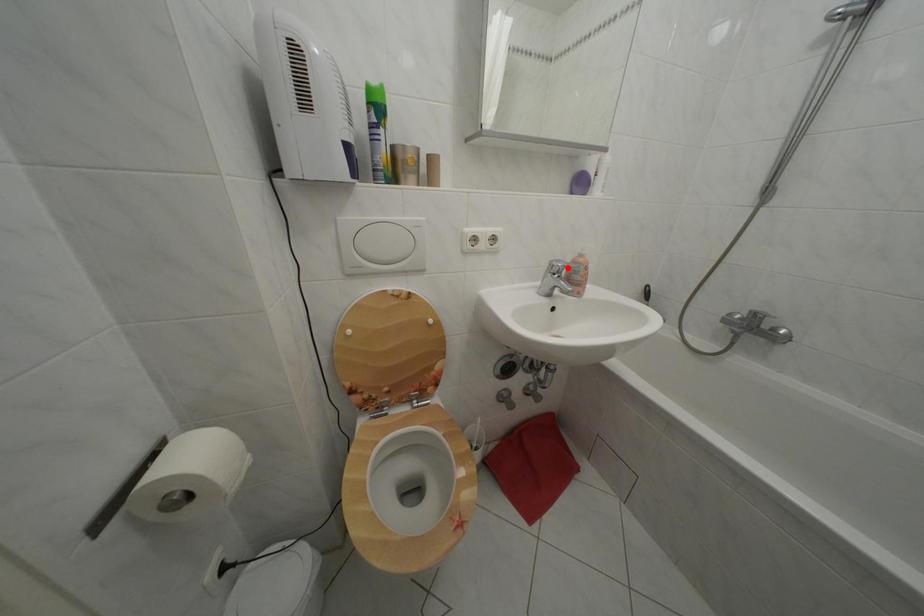
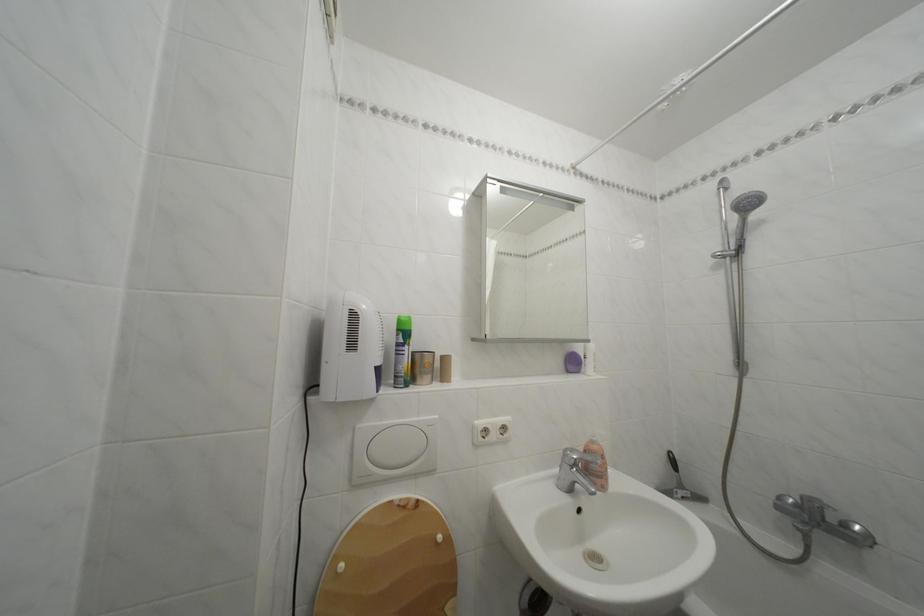
Locate, in the second image, the point that corresponds to the highlighted location in the first image.

(581, 456)